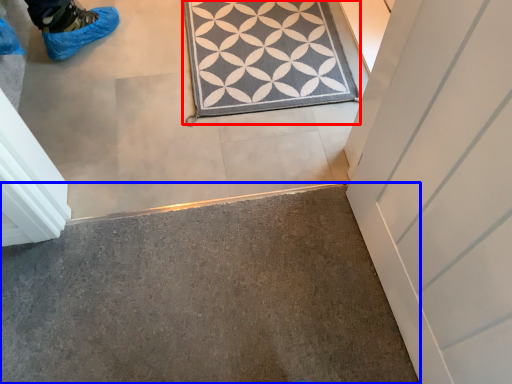
Question: Which object is closer to the camera taking this photo, doormat (highlighted by a red box) or concrete (highlighted by a blue box)?

Choices:
 (A) doormat
 (B) concrete

Answer: (B)